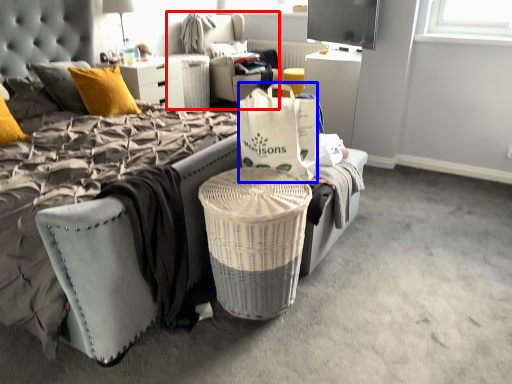
Question: Which object appears farthest to the camera in this image, bean bag chair (highlighted by a red box) or box (highlighted by a blue box)?

Choices:
 (A) bean bag chair
 (B) box

Answer: (A)